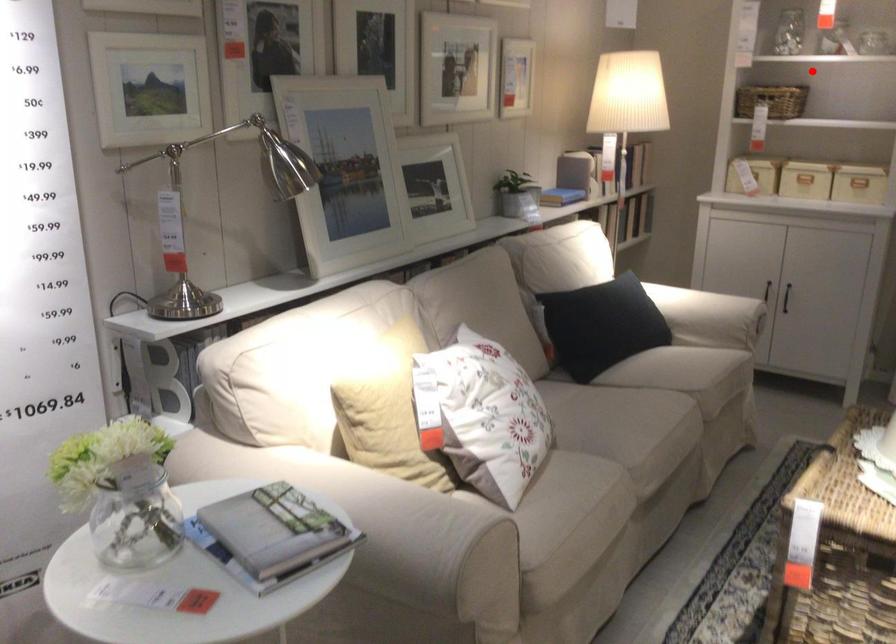
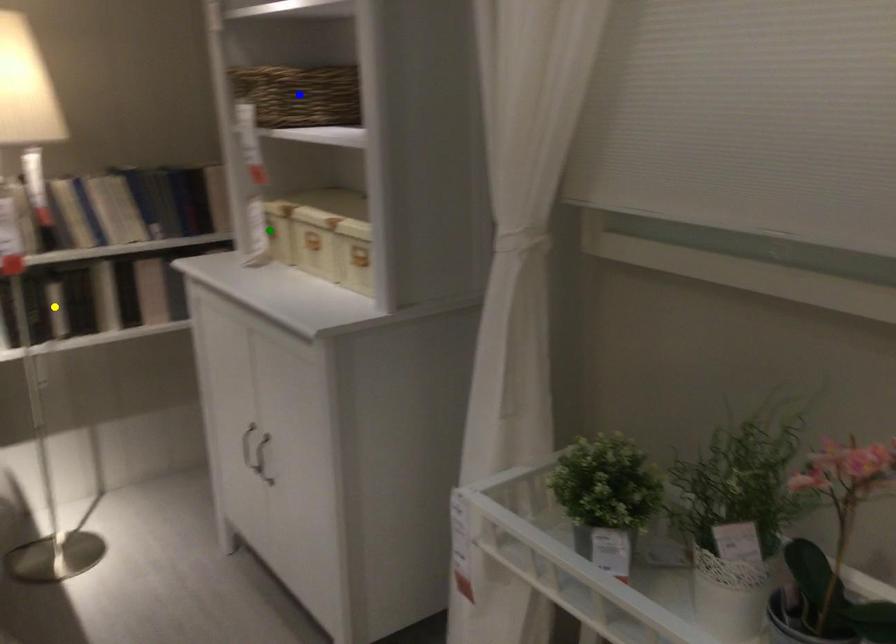
Question: I am providing you with two images of the same scene from different viewpoints. A red point is marked on the first image. You are given multiple points on the second image. Which point in image 2 represents the same 3d spot as the red point in image 1?

Choices:
 (A) green point
 (B) yellow point
 (C) blue point

Answer: (C)